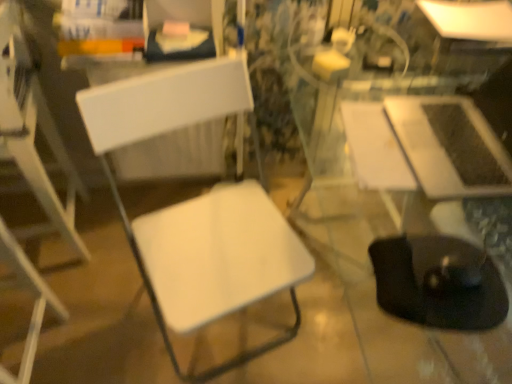
Where is `unoccupied area behind white plastic chair at left, the 1th chair when ordered from left to right`? unoccupied area behind white plastic chair at left, the 1th chair when ordered from left to right is located at coordinates pos(91,292).